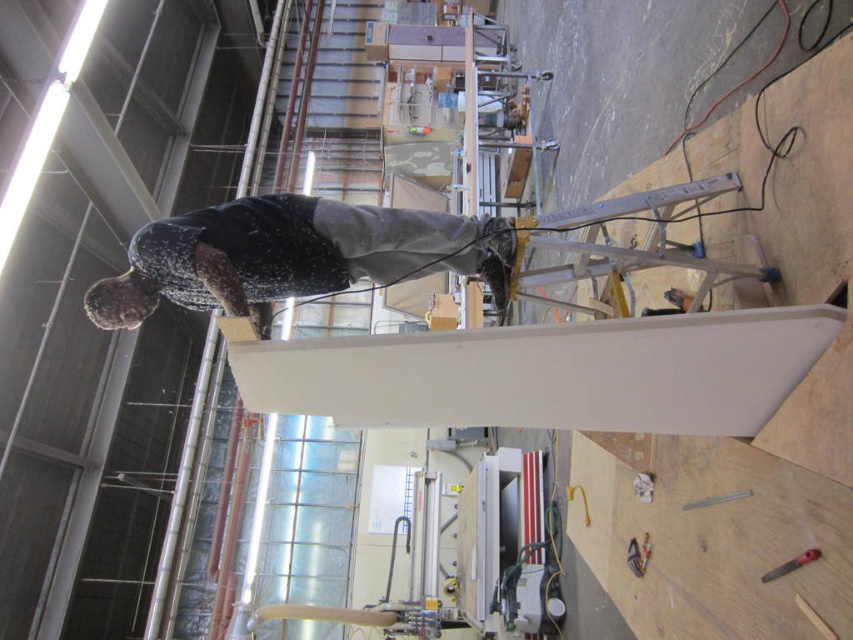
Is white matte beam at center taller than dark gray fabric skateboarder at center?

Yes.

Does point (570, 381) come closer to viewer compared to point (230, 220)?

Yes.

I want to click on white matte beam at center, so click(x=549, y=372).

Does dark gray fabric skateboarder at center have a larger size compared to metallic plastic knife at lower right?

Yes, dark gray fabric skateboarder at center is bigger than metallic plastic knife at lower right.

Identify the location of dark gray fabric skateboarder at center. The width and height of the screenshot is (853, 640). (293, 253).

The image size is (853, 640). I want to click on dark gray fabric skateboarder at center, so click(293, 253).

Is white matte beam at center shorter than metallic plastic knife at lower right?

No, white matte beam at center is not shorter than metallic plastic knife at lower right.

Is white matte beam at center positioned before metallic plastic knife at lower right?

Yes.

Identify the location of white matte beam at center. (549, 372).